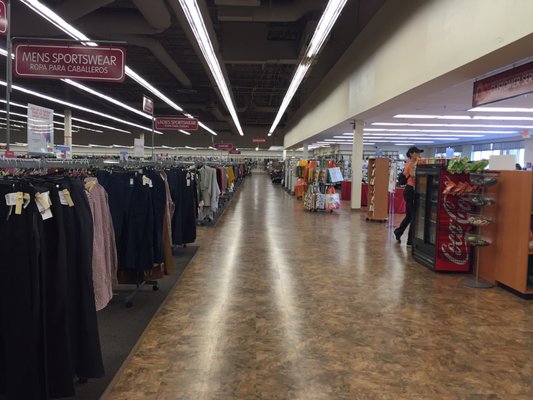
In order to click on window in this screenshot , I will do `click(480, 154)`, `click(524, 152)`.